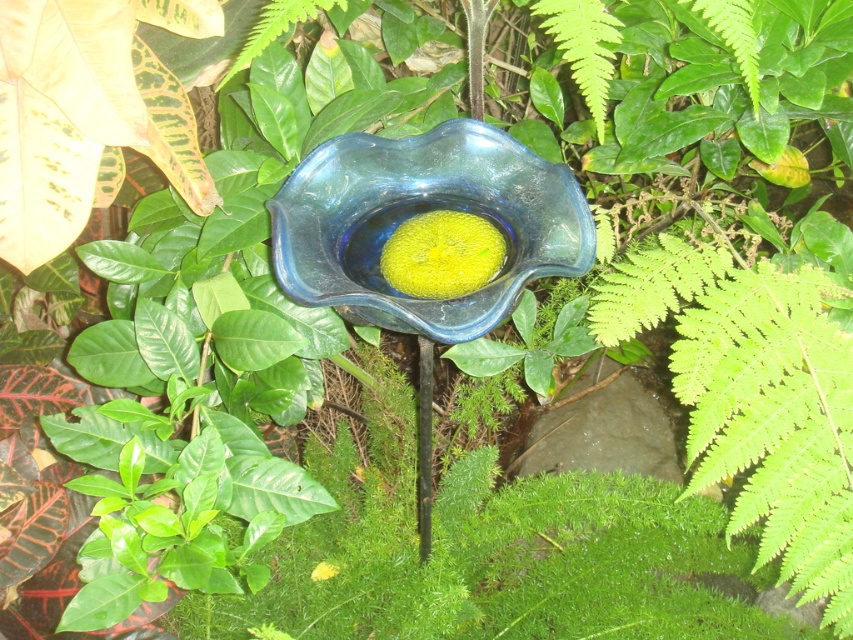
You are a small bird with a wingspan of 30 centimeters. You want to land on the blue glass bowl at center to drink water. Can you safely land on it without your wings touching the ground?

The blue glass bowl at center is 69.55 centimeters away from the viewer. Since the bird has a wingspan of 30 centimeters, which is less than the distance to the bowl, the bird can safely land on the blue glass bowl at center without its wings touching the ground.

You are a gardener who wants to place a new decorative item between the blue glass bowl at center and the yellow matte flower at center. Which direction should you place it so that it is between them?

The blue glass bowl at center is positioned on the right side of the yellow matte flower at center, so to place the new decorative item between them, it should be placed to the right of the yellow matte flower at center and to the left of the blue glass bowl at center.